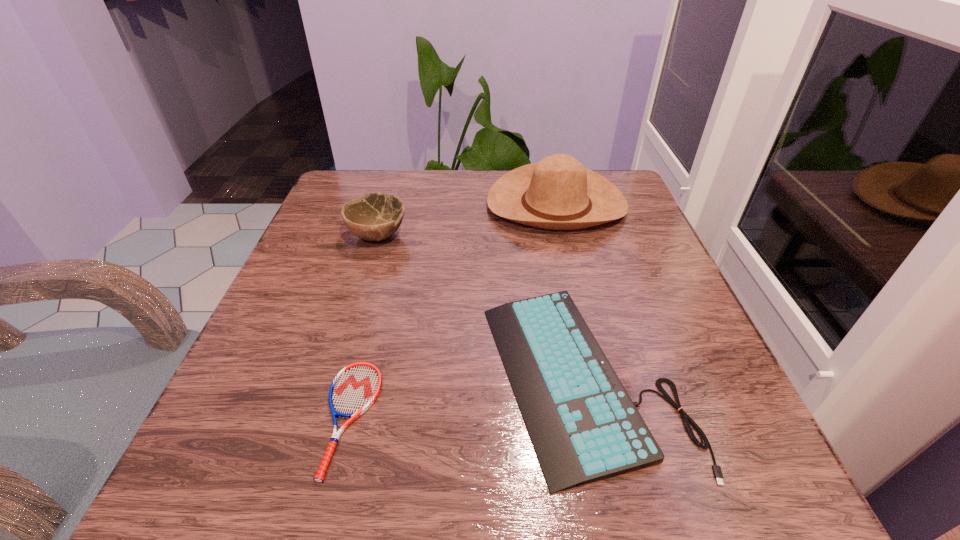
Find the location of a particular element. computer keyboard that is at the near edge is located at coordinates (584, 427).

Where is `tennis racket situated at the near edge`? The width and height of the screenshot is (960, 540). tennis racket situated at the near edge is located at coordinates (355, 388).

This screenshot has height=540, width=960. I want to click on bowl located at the left edge, so click(374, 217).

Where is `tennis racket present at the left edge`? This screenshot has height=540, width=960. tennis racket present at the left edge is located at coordinates (355, 388).

Where is `cowboy hat present at the right edge`? The image size is (960, 540). cowboy hat present at the right edge is located at coordinates (559, 193).

Locate an element on the screen. This screenshot has height=540, width=960. computer keyboard present at the right edge is located at coordinates (584, 427).

The width and height of the screenshot is (960, 540). I want to click on object that is at the far left corner, so click(374, 217).

Where is `object located in the near left corner section of the desktop`? The image size is (960, 540). object located in the near left corner section of the desktop is located at coordinates (355, 388).

This screenshot has width=960, height=540. I want to click on object present at the far right corner, so click(x=559, y=193).

The width and height of the screenshot is (960, 540). I want to click on object present at the near right corner, so click(584, 427).